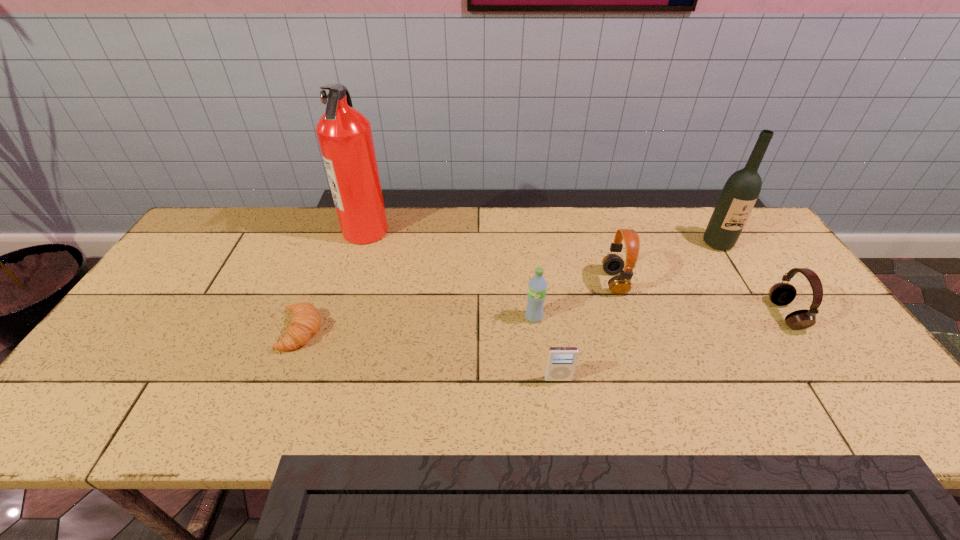
You are a GUI agent. You are given a task and a screenshot of the screen. Output one action in this format:
    pyautogui.click(x=<x>, y=<y>)
    Task: Click on the empty space between the shortest object and the water bottle
    The width and height of the screenshot is (960, 540).
    Given the screenshot: What is the action you would take?
    pyautogui.click(x=418, y=324)

I want to click on the second closest object to the left headset, so click(561, 362).

Identify the location of the second closest object relative to the water bottle. (613, 264).

Locate an element on the screen. Image resolution: width=960 pixels, height=540 pixels. free space that satisfies the following two spatial constraints: 1. at the nozzle of the fire extinguisher; 2. on the front side of the shortest object is located at coordinates 334,331.